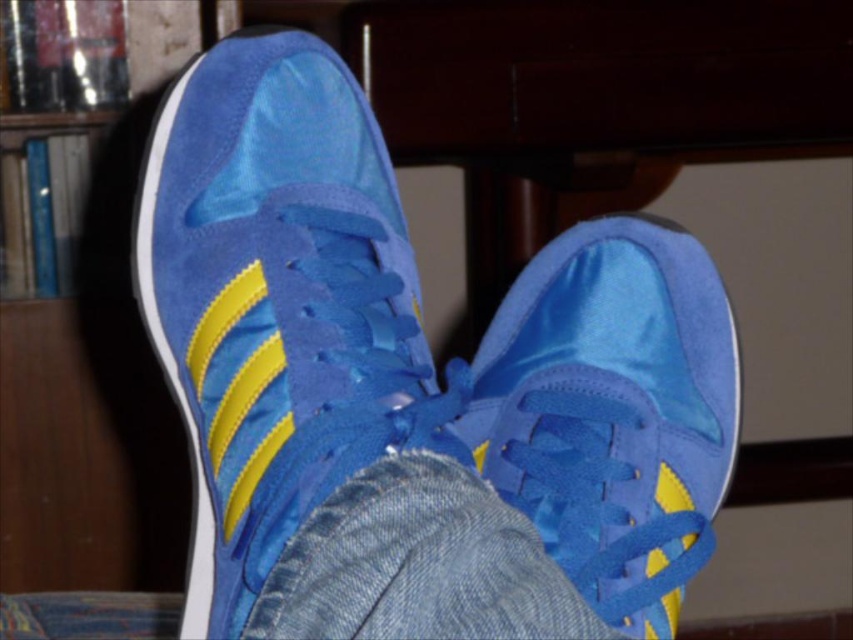
Can you confirm if satin blue sneaker at center is shorter than matte wood bookshelf at left?

Yes.

Does satin blue sneaker at center have a greater height compared to matte wood bookshelf at left?

Incorrect, satin blue sneaker at center's height is not larger of matte wood bookshelf at left's.

Find the location of a particular element. The image size is (853, 640). satin blue sneaker at center is located at coordinates point(277,301).

Can you confirm if satin blue sneaker at center is smaller than blue suede shoe at center?

No.

Is point (320, 429) behind point (605, 285)?

No, (320, 429) is closer to viewer.

Locate an element on the screen. The width and height of the screenshot is (853, 640). satin blue sneaker at center is located at coordinates (277, 301).

Which is below, blue suede shoe at center or matte wood bookshelf at left?

Positioned lower is blue suede shoe at center.

Who is higher up, blue suede shoe at center or matte wood bookshelf at left?

matte wood bookshelf at left

Is point (643, 300) in front of point (79, 376)?

Yes, point (643, 300) is in front of point (79, 376).

The width and height of the screenshot is (853, 640). I want to click on blue suede shoe at center, so click(613, 410).